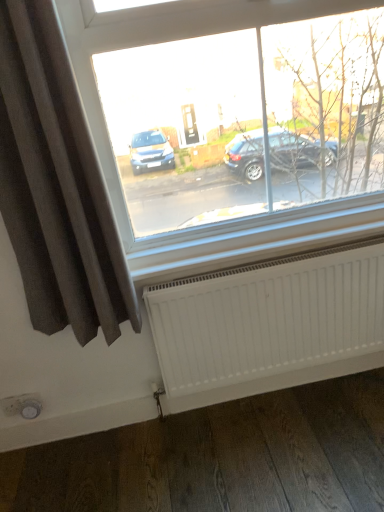
Image resolution: width=384 pixels, height=512 pixels. What are the coordinates of `empty space that is ontop of white matte radiator at lower center (from a real-world perspective)` in the screenshot? It's located at (253, 262).